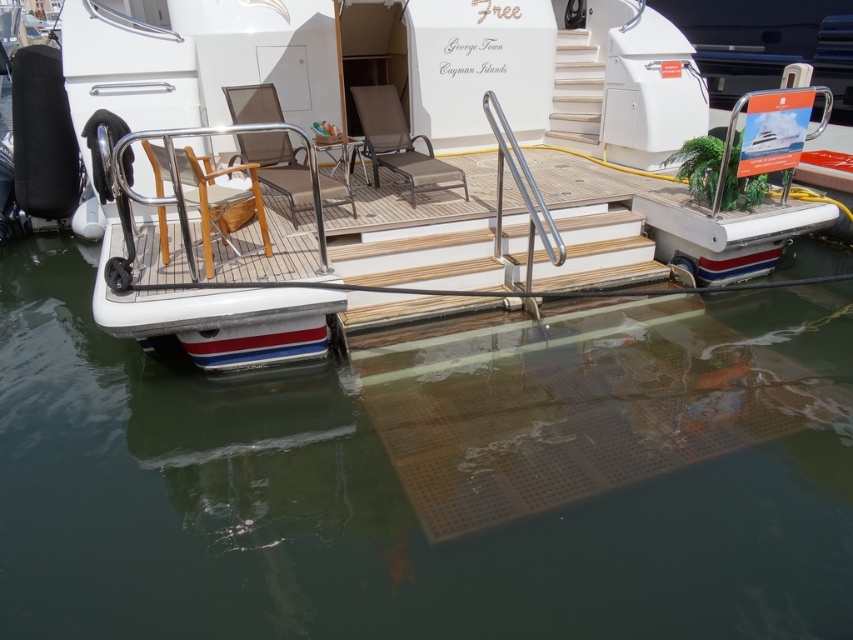
Question: Which is farther from the wooden chair at center?

Choices:
 (A) white glossy boat at center
 (B) stainless steel handrail at center
 (C) brown fabric chaise lounge at center
 (D) brown mesh chair at center

Answer: (A)

Question: Considering the relative positions of wooden chair at center and stainless steel handrail at center in the image provided, where is wooden chair at center located with respect to stainless steel handrail at center?

Choices:
 (A) above
 (B) below

Answer: (B)

Question: Is clear water at lower center behind white glossy boat at center?

Choices:
 (A) no
 (B) yes

Answer: (A)

Question: Estimate the real-world distances between objects in this image. Which object is closer to the clear water at lower center?

Choices:
 (A) brown mesh chair at center
 (B) stainless steel handrail at center
 (C) wooden chair at center
 (D) brown fabric chaise lounge at center

Answer: (B)

Question: Does clear water at lower center have a greater width compared to brown mesh chair at center?

Choices:
 (A) no
 (B) yes

Answer: (B)

Question: Which point appears closest to the camera in this image?

Choices:
 (A) (229, 106)
 (B) (467, 148)
 (C) (61, 330)
 (D) (486, 90)

Answer: (C)